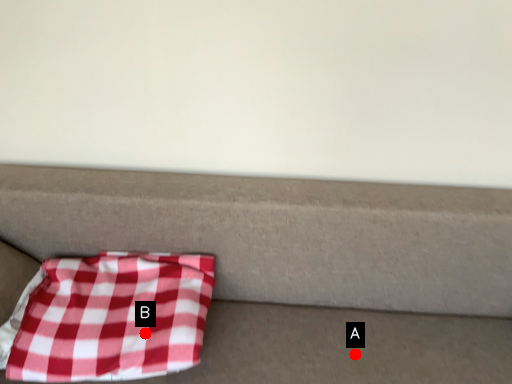
Question: Two points are circled on the image, labeled by A and B beside each circle. Which point is closer to the camera?

Choices:
 (A) A is closer
 (B) B is closer

Answer: (B)